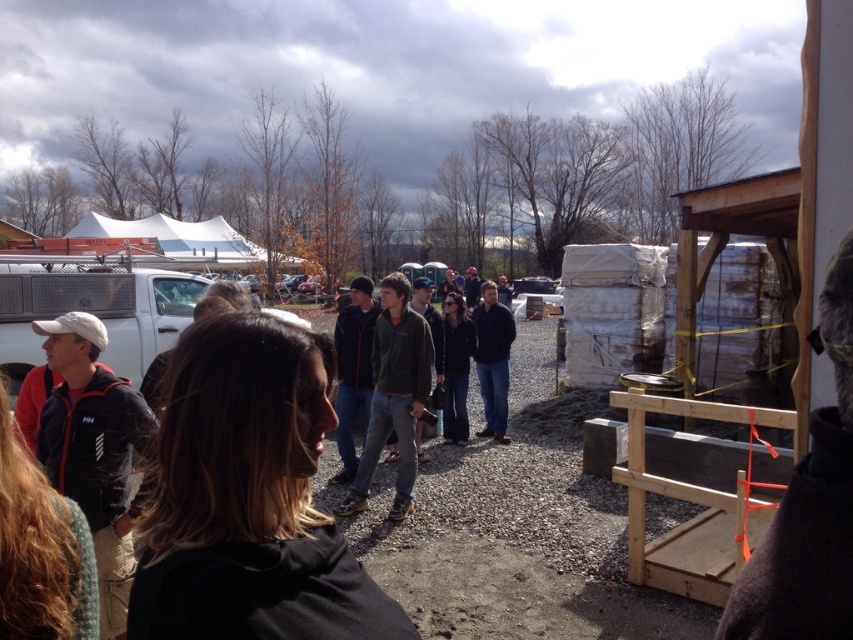
You are standing at the construction site and need to determine the visibility of two points marked in the image. Which point, point [390,275] or point [498,412], is closer to you?

Point [390,275] is further to the viewer than point [498,412], so the closer point to you is point [498,412].

You are standing at the point marked as point (393, 396) in the image. What object is located exactly at that point?

The green matte jacket at center is located exactly at point (393, 396).

You are a photographer trying to capture a group photo of the green matte jacket at center and the dark blue jacket at center. Since you want to ensure both jackets are visible in the frame, which jacket should you position closer to the camera to avoid cropping?

To ensure both jackets are visible in the frame, position the green matte jacket at center closer to the camera since it has a lesser width compared to the dark blue jacket at center. This way, the wider dark blue jacket at center can be accommodated without cropping.